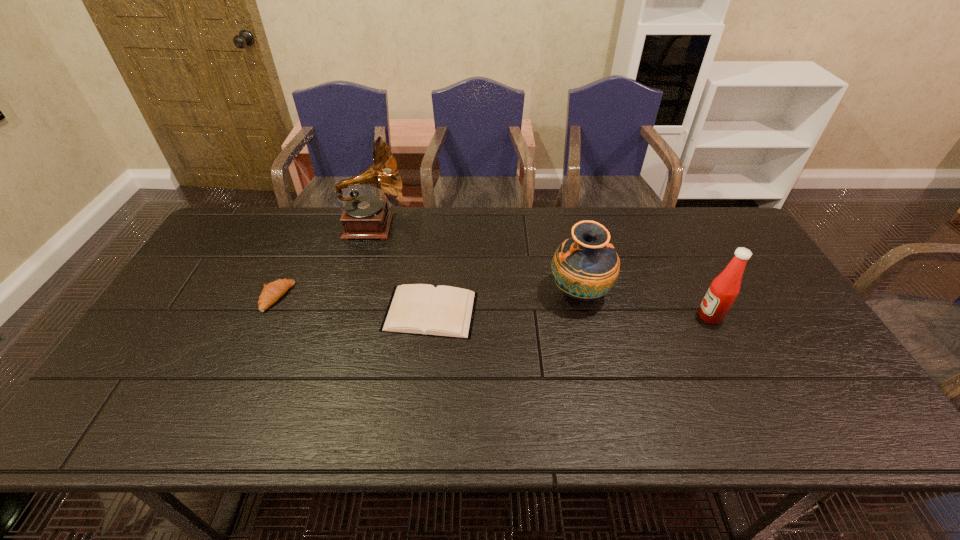
Identify the location of the farthest object. The image size is (960, 540). (365, 217).

Where is `phonograph_record`? This screenshot has width=960, height=540. phonograph_record is located at coordinates (365, 217).

Where is `the rightmost object`? The height and width of the screenshot is (540, 960). the rightmost object is located at coordinates (724, 289).

Locate an element on the screen. Image resolution: width=960 pixels, height=540 pixels. the fourth object from left to right is located at coordinates (585, 266).

The width and height of the screenshot is (960, 540). Identify the location of the fourth tallest object. (273, 291).

You are a GUI agent. You are given a task and a screenshot of the screen. Output one action in this format:
    pyautogui.click(x=<x>, y=<y>)
    Task: Click on the crescent roll
    
    Given the screenshot: What is the action you would take?
    pyautogui.click(x=273, y=291)

At what (x,y) coordinates should I click in order to perform the action: click on the shortest object. Please return your answer as a coordinate pair (x, y). Looking at the image, I should click on (421, 309).

Identify the location of blank space located 0.400m on the horn of the farthest object. (524, 226).

This screenshot has width=960, height=540. Identify the location of blank space located 0.360m on the front-facing side of the condiment. (565, 316).

The image size is (960, 540). What are the coordinates of `free space located on the front-facing side of the condiment` in the screenshot? It's located at (646, 316).